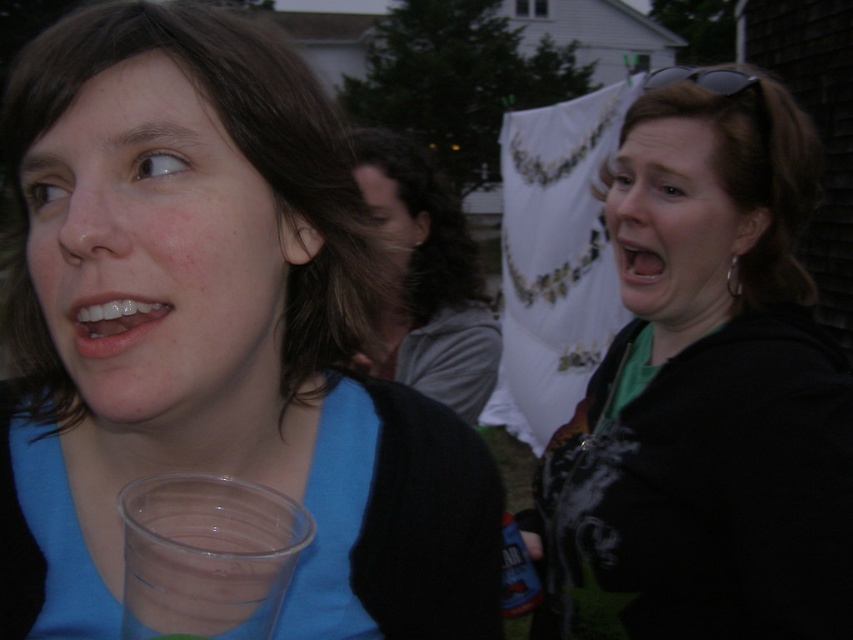
Question: In this image, where is smooth brown hair at center located relative to smooth glossy mouth at center right?

Choices:
 (A) right
 (B) left

Answer: (B)

Question: Which of the following is the closest to the observer?

Choices:
 (A) white glossy teeth at lower left
 (B) blue matte shirt at upper left
 (C) translucent plastic cup at lower left
 (D) smooth brown hair at center

Answer: (B)

Question: Observing the image, what is the correct spatial positioning of matte black jacket at right in reference to white glossy teeth at lower left?

Choices:
 (A) below
 (B) above

Answer: (B)

Question: Which object appears farthest from the camera in this image?

Choices:
 (A) smooth brown hair at center
 (B) smooth glossy mouth at center right
 (C) matte black jacket at right

Answer: (A)

Question: Does white glossy teeth at lower left appear on the right side of smooth glossy mouth at center right?

Choices:
 (A) yes
 (B) no

Answer: (B)

Question: Among these objects, which one is farthest from the camera?

Choices:
 (A) matte blue shirt at left
 (B) smooth brown hair at center
 (C) matte black jacket at right
 (D) blue matte shirt at upper left

Answer: (B)